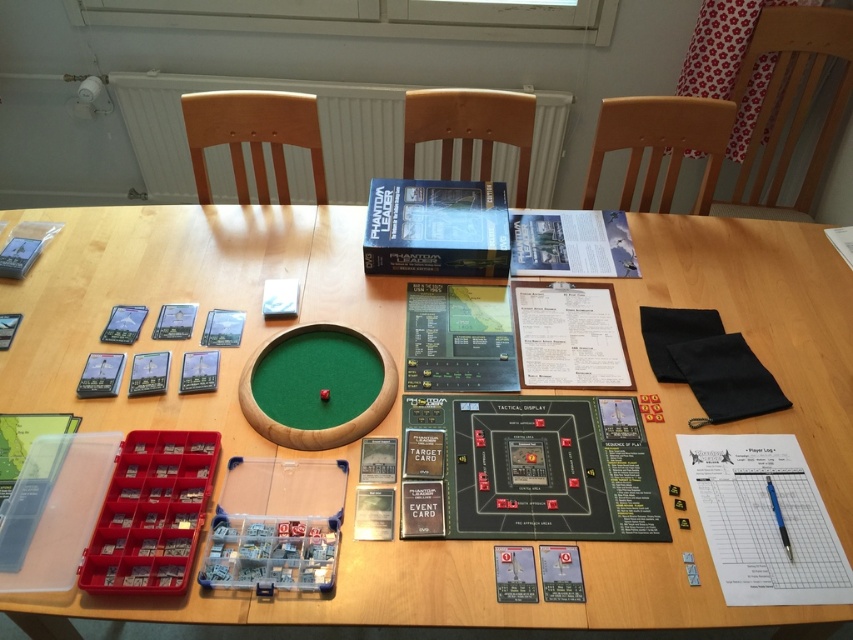
Is green felt circle at center further to the viewer compared to blue plastic pen at center-right?

No, green felt circle at center is in front of blue plastic pen at center-right.

Can you confirm if green felt circle at center is taller than blue plastic pen at center-right?

Correct, green felt circle at center is much taller as blue plastic pen at center-right.

Who is more distant from viewer, (285, 609) or (769, 490)?

Point (769, 490)

Find the location of `green felt circle at center`. green felt circle at center is located at coordinates (401, 390).